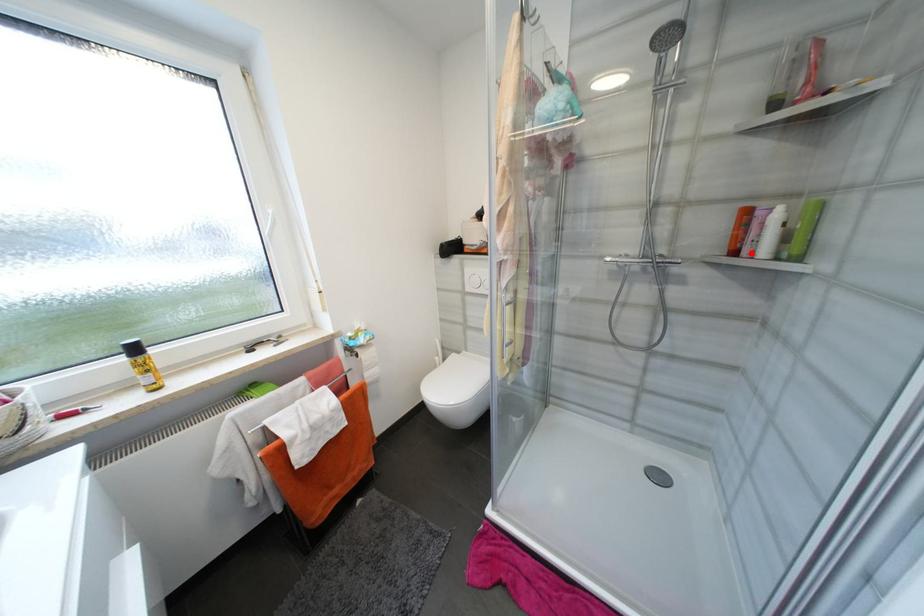
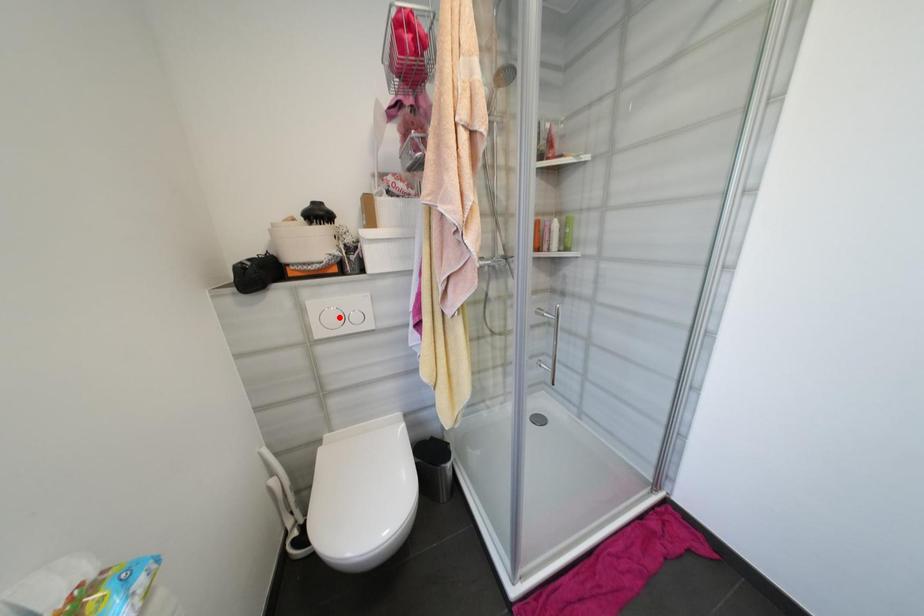
I am providing you with two images of the same scene from different viewpoints. A red point is marked on the first image and another point is marked on the second image. Is the red point in image1 aligned with the point shown in image2?

No